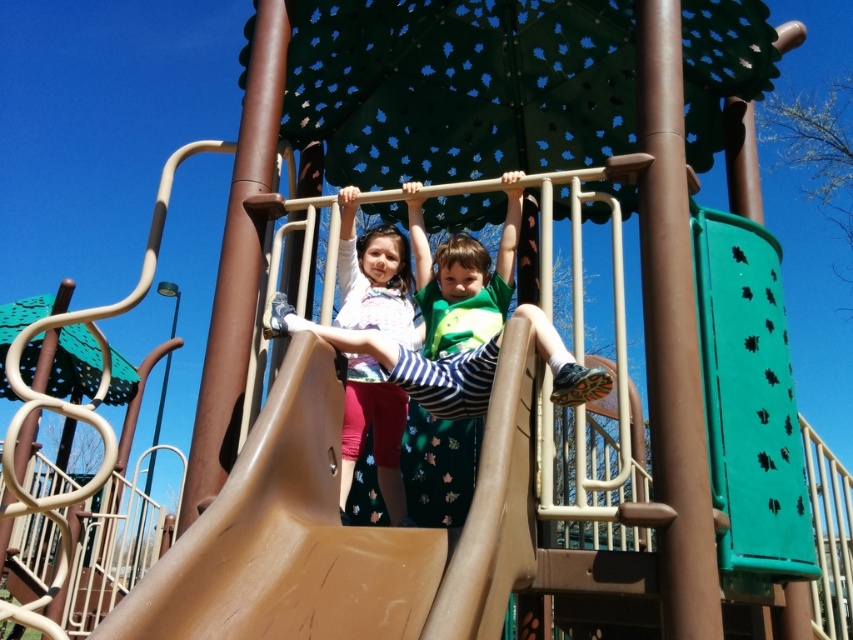
Does matte striped shirt at center lie behind matte white shirt at center?

No.

From the picture: Who is more forward, (x=335, y=328) or (x=376, y=461)?

Positioned in front is point (x=335, y=328).

Where is `matte striped shirt at center`? The height and width of the screenshot is (640, 853). matte striped shirt at center is located at coordinates (410, 364).

Identify the location of brown matte slide at center. (341, 532).

Is brown matte slide at center further to camera compared to matte white shirt at center?

No, it is not.

Does point (445, 564) lie behind point (363, 413)?

No, it is in front of (363, 413).

The width and height of the screenshot is (853, 640). In order to click on brown matte slide at center in this screenshot , I will do `click(341, 532)`.

Which is above, brown matte slide at center or matte striped shirt at center?

matte striped shirt at center

The image size is (853, 640). Identify the location of brown matte slide at center. (341, 532).

Identify the location of brown matte slide at center. This screenshot has height=640, width=853. click(x=341, y=532).

Find the location of a particular element. brown matte slide at center is located at coordinates (341, 532).